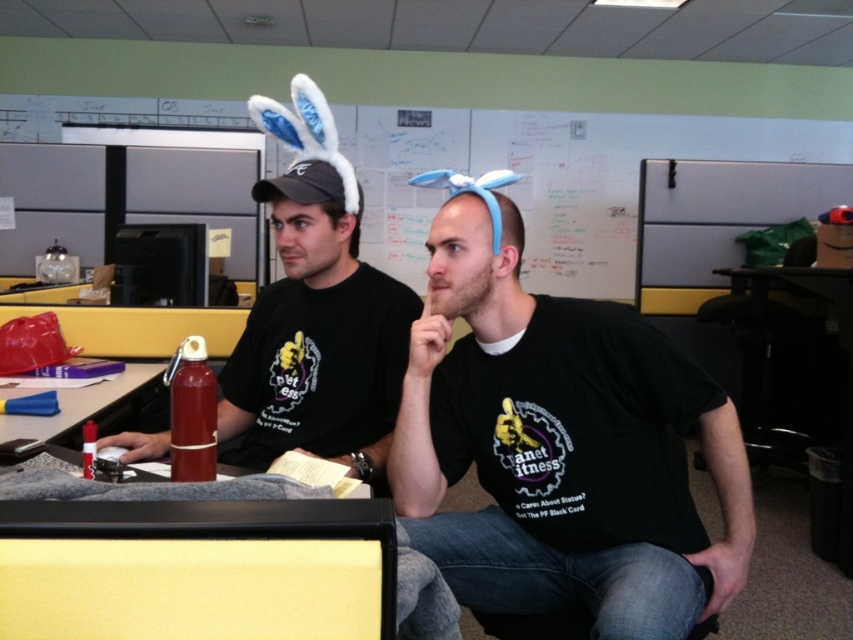
Does black matte t-shirt at center have a lesser width compared to white matte bulletin board at upper right?

Correct, black matte t-shirt at center's width is less than white matte bulletin board at upper right's.

Does black matte t-shirt at center have a smaller size compared to white matte bulletin board at upper right?

Actually, black matte t-shirt at center might be larger than white matte bulletin board at upper right.

Is point (671, 621) less distant than point (708, 173)?

Yes, point (671, 621) is in front of point (708, 173).

Where is `black matte t-shirt at center`? The image size is (853, 640). black matte t-shirt at center is located at coordinates point(560,445).

Is point (303, 266) positioned before point (83, 413)?

Yes, it is.

You are a GUI agent. You are given a task and a screenshot of the screen. Output one action in this format:
    pyautogui.click(x=<x>, y=<y>)
    Task: Click on the matte black t-shirt at center
    The image size is (853, 640).
    Given the screenshot: What is the action you would take?
    pyautogui.click(x=317, y=337)

Does point (326, 173) come farther from viewer compared to point (96, 420)?

No, it is in front of (96, 420).

Find the location of `matte black t-shirt at center`. matte black t-shirt at center is located at coordinates (317, 337).

Does black matte t-shirt at center have a lesser width compared to metallic red thermos at left?

Incorrect, black matte t-shirt at center's width is not less than metallic red thermos at left's.

Between point (453, 428) and point (108, 400), which one is positioned behind?

The point (108, 400) is more distant.

Locate an element on the screen. The width and height of the screenshot is (853, 640). black matte t-shirt at center is located at coordinates (560, 445).